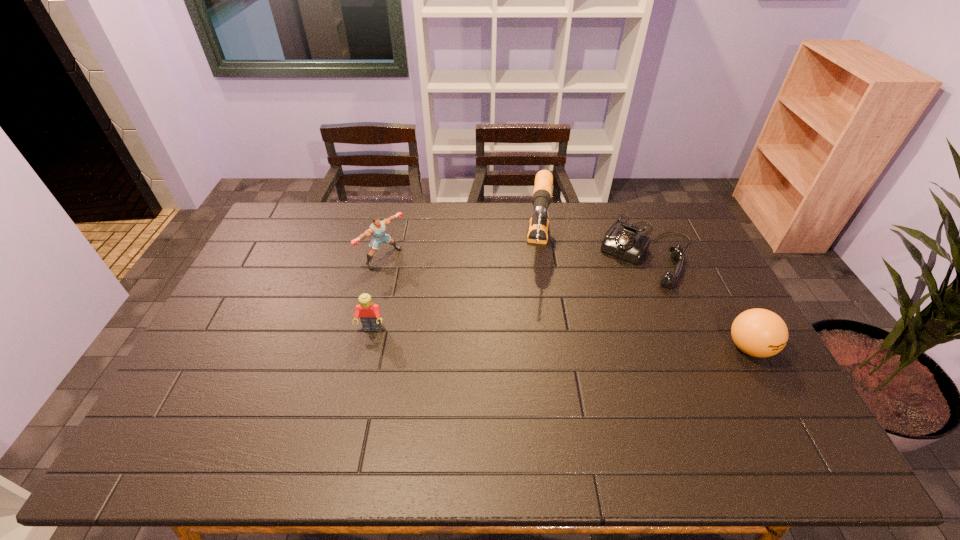
The image size is (960, 540). What are the coordinates of `vacant space located 0.100m on the dial of the telephone` in the screenshot? It's located at (622, 302).

The image size is (960, 540). I want to click on vacant space located 0.330m on the handle side of the drill, so click(x=535, y=370).

Locate an element on the screen. Image resolution: width=960 pixels, height=540 pixels. vacant space located 0.260m on the handle side of the drill is located at coordinates (537, 349).

The width and height of the screenshot is (960, 540). I want to click on vacant area located on the handle side of the drill, so click(540, 309).

In order to click on vacant area located 0.230m on the front-facing side of the second tallest object in this screenshot , I will do `click(447, 300)`.

You are a GUI agent. You are given a task and a screenshot of the screen. Output one action in this format:
    pyautogui.click(x=<x>, y=<y>)
    Task: Click on the free location located on the front-facing side of the second tallest object
    The width and height of the screenshot is (960, 540).
    Given the screenshot: What is the action you would take?
    pyautogui.click(x=412, y=277)

Find the location of a particular element. This screenshot has height=540, width=960. vacant space located on the front-facing side of the second tallest object is located at coordinates (419, 281).

Where is `telephone that is at the far edge`? This screenshot has width=960, height=540. telephone that is at the far edge is located at coordinates (625, 242).

Find the location of a particular element. drill that is positioned at the far edge is located at coordinates (538, 228).

This screenshot has height=540, width=960. Identify the location of puncher located at the far edge. (377, 229).